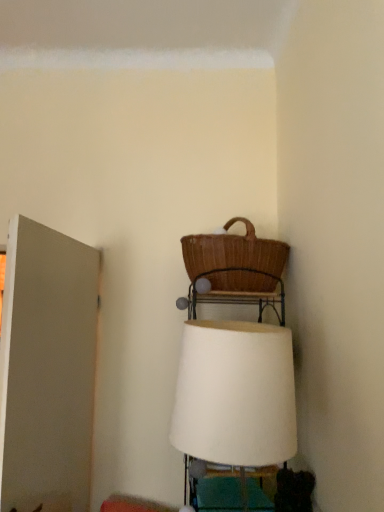
Measure the distance between brown wicker picnic basket at upper center and camera.

5.48 feet.

You are a GUI agent. You are given a task and a screenshot of the screen. Output one action in this format:
    pyautogui.click(x=<x>, y=<y>)
    Task: Click on the brown wicker picnic basket at upper center
    The height and width of the screenshot is (512, 384).
    Given the screenshot: What is the action you would take?
    pyautogui.click(x=235, y=260)

Based on the photo, between white matte door at left and white fabric lampshade at center, which one has less height?

white fabric lampshade at center.

Is white fabric lampshade at center at the back of white matte door at left?

Yes, white fabric lampshade at center is at the back of white matte door at left.

Does white matte door at left appear on the right side of white fabric lampshade at center?

Incorrect, white matte door at left is not on the right side of white fabric lampshade at center.

In the image, there is a white matte door at left. Where is `lamp below it (from a real-world perspective)`? This screenshot has width=384, height=512. lamp below it (from a real-world perspective) is located at coordinates (235, 394).

Considering the relative positions of brown wicker picnic basket at upper center and white fabric lampshade at center in the image provided, is brown wicker picnic basket at upper center to the right of white fabric lampshade at center from the viewer's perspective?

Yes.

Is the depth of brown wicker picnic basket at upper center greater than that of white fabric lampshade at center?

That is True.

Looking at the image, does brown wicker picnic basket at upper center seem bigger or smaller compared to white fabric lampshade at center?

brown wicker picnic basket at upper center is smaller than white fabric lampshade at center.

Is white fabric lampshade at center at the back of brown wicker picnic basket at upper center?

brown wicker picnic basket at upper center is not turned away from white fabric lampshade at center.

Between white matte door at left and brown wicker picnic basket at upper center, which one appears on the left side from the viewer's perspective?

Positioned to the left is white matte door at left.

From the image's perspective, is white matte door at left on top of brown wicker picnic basket at upper center?

Incorrect, from the image's perspective, white matte door at left is lower than brown wicker picnic basket at upper center.

Considering the positions of objects white matte door at left and brown wicker picnic basket at upper center in the image provided, who is in front, white matte door at left or brown wicker picnic basket at upper center?

Positioned in front is white matte door at left.

Between white fabric lampshade at center and white matte door at left, which one appears on the left side from the viewer's perspective?

From the viewer's perspective, white matte door at left appears more on the left side.

Is white fabric lampshade at center taller or shorter than white matte door at left?

white fabric lampshade at center is shorter than white matte door at left.

Is white matte door at left at the back of white fabric lampshade at center?

No, white fabric lampshade at center's orientation is not away from white matte door at left.

Considering the points (295, 424) and (9, 239), which point is behind, point (295, 424) or point (9, 239)?

The point (9, 239) is farther.

Considering the sizes of objects white fabric lampshade at center and brown wicker picnic basket at upper center in the image provided, who is bigger, white fabric lampshade at center or brown wicker picnic basket at upper center?

With larger size is white fabric lampshade at center.

Considering the relative sizes of white fabric lampshade at center and brown wicker picnic basket at upper center in the image provided, is white fabric lampshade at center thinner than brown wicker picnic basket at upper center?

Correct, the width of white fabric lampshade at center is less than that of brown wicker picnic basket at upper center.

Between point (251, 420) and point (192, 262), which one is positioned behind?

Positioned behind is point (192, 262).

Is white fabric lampshade at center inside the boundaries of brown wicker picnic basket at upper center, or outside?

The correct answer is: outside.

Considering the relative positions of brown wicker picnic basket at upper center and white matte door at left in the image provided, is brown wicker picnic basket at upper center to the right of white matte door at left from the viewer's perspective?

Yes, brown wicker picnic basket at upper center is to the right of white matte door at left.

Is brown wicker picnic basket at upper center aimed at white matte door at left?

Yes, brown wicker picnic basket at upper center is oriented towards white matte door at left.

Can you confirm if brown wicker picnic basket at upper center is wider than white matte door at left?

Correct, the width of brown wicker picnic basket at upper center exceeds that of white matte door at left.

In the scene shown: From a real-world perspective, who is located lower, brown wicker picnic basket at upper center or white matte door at left?

In real-world perspective, white matte door at left is lower.

You are a GUI agent. You are given a task and a screenshot of the screen. Output one action in this format:
    pyautogui.click(x=<x>, y=<y>)
    Task: Click on the door lying behind the white fabric lampshade at center
    The width and height of the screenshot is (384, 512).
    Given the screenshot: What is the action you would take?
    pyautogui.click(x=47, y=368)

Locate an element on the screen. Image resolution: width=384 pixels, height=512 pixels. lamp in front of the brown wicker picnic basket at upper center is located at coordinates (235, 394).

Looking at the image, which one is located further to brown wicker picnic basket at upper center, white matte door at left or white fabric lampshade at center?

white matte door at left is positioned further to the anchor brown wicker picnic basket at upper center.

Looking at the image, which one is located further to white fabric lampshade at center, brown wicker picnic basket at upper center or white matte door at left?

white matte door at left is positioned further to the anchor white fabric lampshade at center.

From the image, which object appears to be farther from white matte door at left, brown wicker picnic basket at upper center or white fabric lampshade at center?

white fabric lampshade at center.

When comparing their distances from white matte door at left, does white fabric lampshade at center or brown wicker picnic basket at upper center seem closer?

Based on the image, brown wicker picnic basket at upper center appears to be nearer to white matte door at left.

Looking at the image, which one is located closer to brown wicker picnic basket at upper center, white fabric lampshade at center or white matte door at left?

Among the two, white fabric lampshade at center is located nearer to brown wicker picnic basket at upper center.

Looking at this image, considering their positions, is white matte door at left positioned further to white fabric lampshade at center than brown wicker picnic basket at upper center?

Based on the image, white matte door at left appears to be further to white fabric lampshade at center.

What are the coordinates of `lamp located between white matte door at left and brown wicker picnic basket at upper center in the left-right direction` in the screenshot? It's located at (235, 394).